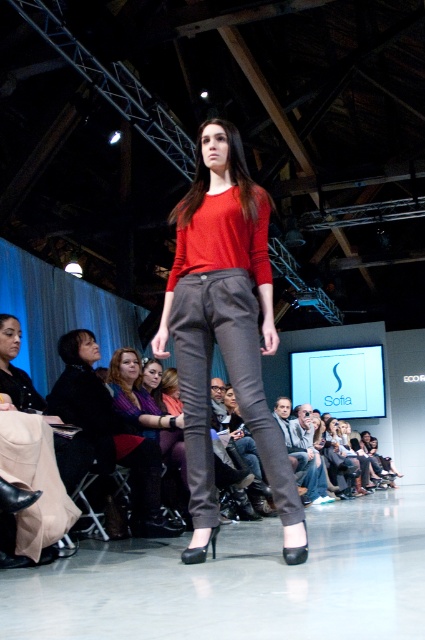
You are a fashion designer who wants to create a matching outfit using the matte purple sweater at center and the matte gray pants at center. Considering their sizes, which piece would you adjust to ensure they proportionally match?

The matte purple sweater at center has a smaller size compared to the matte gray pants at center. To ensure proportional matching, you should increase the size of the matte purple sweater at center to match the larger size of the matte gray pants at center.

You are a photographer standing behind the camera. You want to take a photo of the matte red sweater at center without any obstructions. Is the camera close enough to capture the sweater clearly?

The matte red sweater at center and camera are 2.64 meters apart, so yes, the camera is close enough to capture the sweater clearly.

You are a fashion designer observing the runway show. You notice the matte purple sweater at center and the matte gray pants at center. Which item of clothing is narrower in width?

The matte purple sweater at center is thinner than the matte gray pants at center, so the matte purple sweater at center is narrower in width.